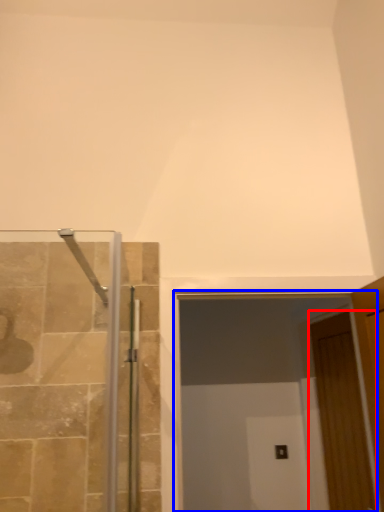
Question: Which object appears farthest to the camera in this image, door (highlighted by a red box) or glass door (highlighted by a blue box)?

Choices:
 (A) door
 (B) glass door

Answer: (A)